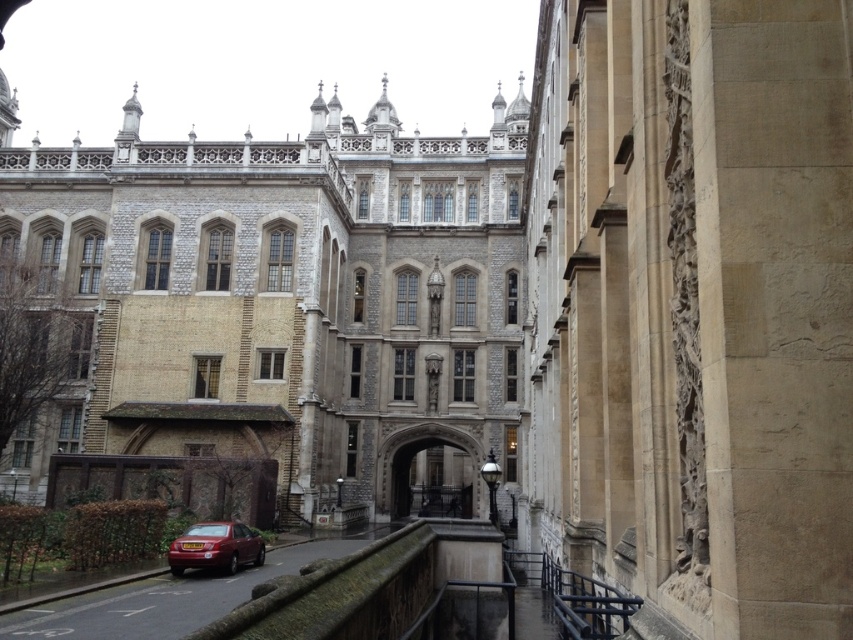
You are standing in front of the historic building and notice a shiny red sedan at lower center and a stone archway at center. Which object is positioned higher in the image?

The shiny red sedan at lower center is positioned higher than the stone archway at center.

You are driving a shiny red sedan at lower center and want to pass through the stone archway at center. Can your car fit through the archway?

The shiny red sedan at lower center is narrower than the stone archway at center, so it should fit through the archway without any issues.